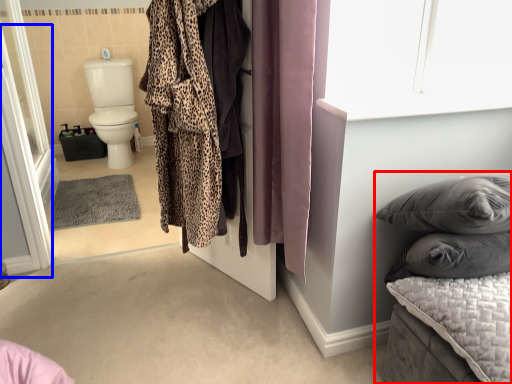
Question: Which object appears closest to the camera in this image, furniture (highlighted by a red box) or screen door (highlighted by a blue box)?

Choices:
 (A) furniture
 (B) screen door

Answer: (A)